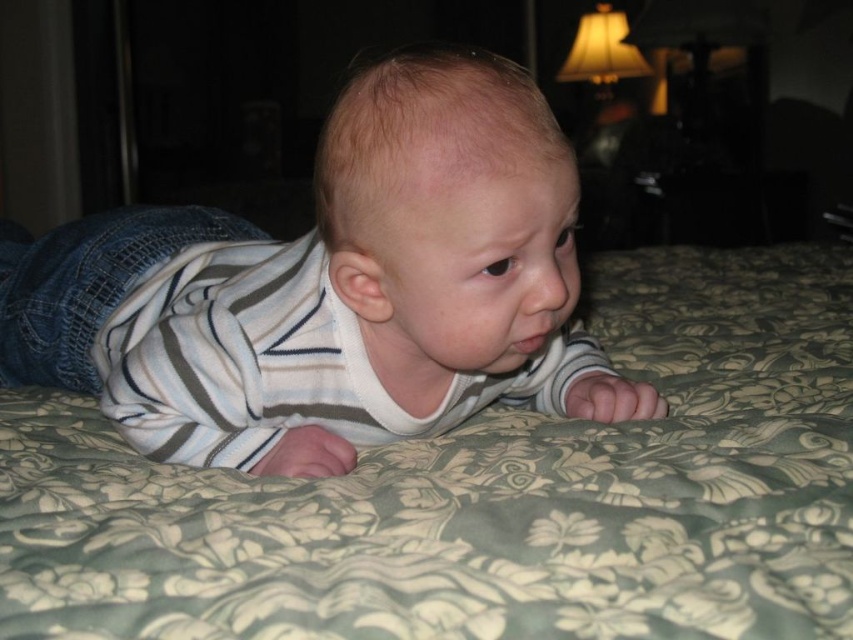
Does floral fabric bedcover at center have a greater width compared to white striped shirt at center?

Yes, floral fabric bedcover at center is wider than white striped shirt at center.

Can you confirm if floral fabric bedcover at center is positioned below white striped shirt at center?

No, floral fabric bedcover at center is not below white striped shirt at center.

Which is in front, point (112, 481) or point (349, 236)?

Point (349, 236)

Find the location of a particular element. The image size is (853, 640). floral fabric bedcover at center is located at coordinates (489, 493).